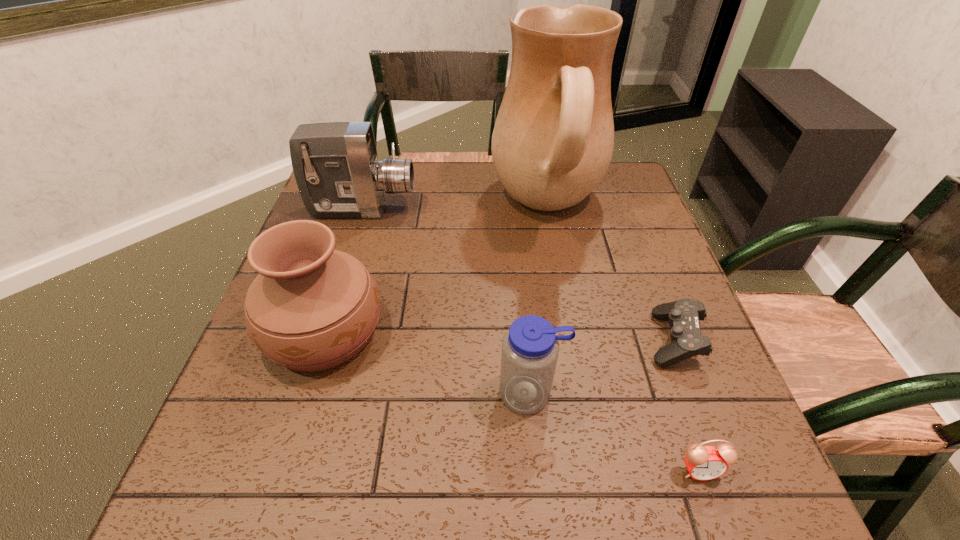
Identify which object is located as the nearest to the water bottle. Please provide its 2D coordinates. Your answer should be formatted as a tuple, i.e. [(x, y)], where the tuple contains the x and y coordinates of a point satisfying the conditions above.

[(704, 463)]

Locate which object ranks in proximity to the control. Please provide its 2D coordinates. Your answer should be formatted as a tuple, i.e. [(x, y)], where the tuple contains the x and y coordinates of a point satisfying the conditions above.

[(553, 140)]

The image size is (960, 540). I want to click on vacant area in the image that satisfies the following two spatial constraints: 1. at the spout of the tallest object; 2. with a carrying loop on the side of the third shortest object, so click(x=582, y=393).

Image resolution: width=960 pixels, height=540 pixels. What are the coordinates of `free location that satisfies the following two spatial constraints: 1. at the spout of the tallest object; 2. on the front side of the urn` in the screenshot? It's located at (570, 330).